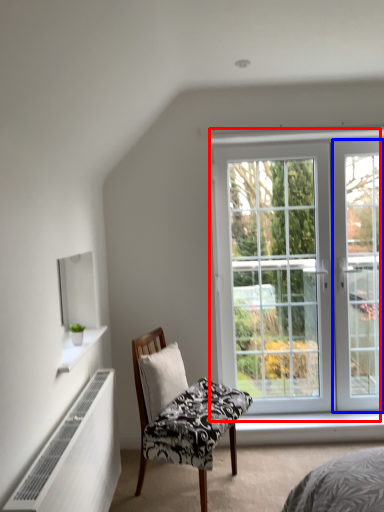
Question: Which of the following is the farthest to the observer, window (highlighted by a red box) or screen door (highlighted by a blue box)?

Choices:
 (A) window
 (B) screen door

Answer: (B)